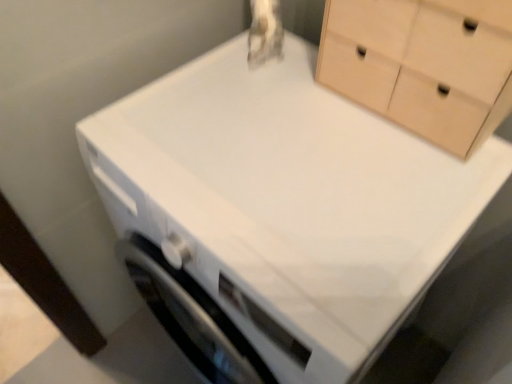
The width and height of the screenshot is (512, 384). I want to click on vacant space in front of matte cardboard chest of drawers at upper right, so click(x=394, y=192).